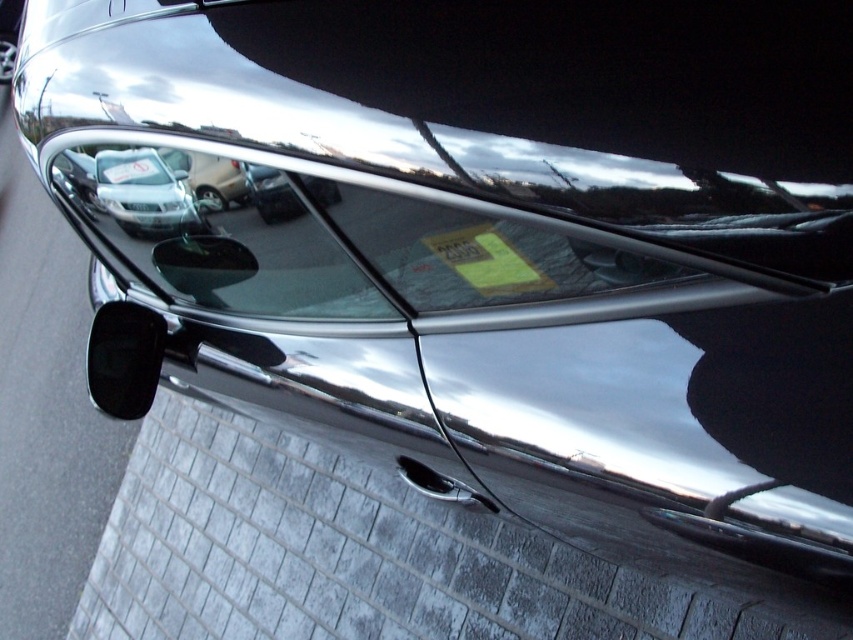
Between clear glass window at center and white plastic license plate at center, which one has more height?

clear glass window at center is taller.

The image size is (853, 640). Describe the element at coordinates (216, 230) in the screenshot. I see `clear glass window at center` at that location.

Where is `clear glass window at center`? clear glass window at center is located at coordinates (216, 230).